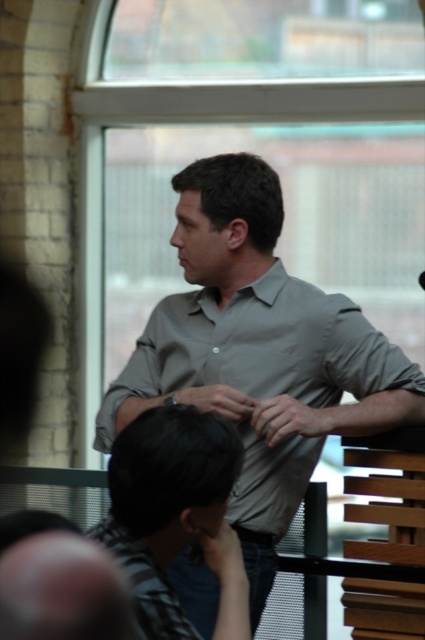
You are a photographer trying to capture a closeup of the black striped shirt at lower center and the matte gray hand at center. Given that your camera can only focus on objects within a 10cm depth range, can you adjust your position so that both objects are in focus at the same time?

The black striped shirt at lower center has a larger size compared to matte gray hand at center, but this does not indicate their distance from the camera. Without knowing their exact positions, it is impossible to determine if they can be in focus simultaneously within the 10cm depth range.

You are a photographer trying to capture a closeup of the matte gray wristwatch at center. However, the gray matte shirt at center is blocking your view. Can you adjust your angle to see the wristwatch without moving any objects?

The gray matte shirt at center is positioned over the matte gray wristwatch at center, so adjusting your angle might allow you to see the wristwatch by looking underneath the shirt.